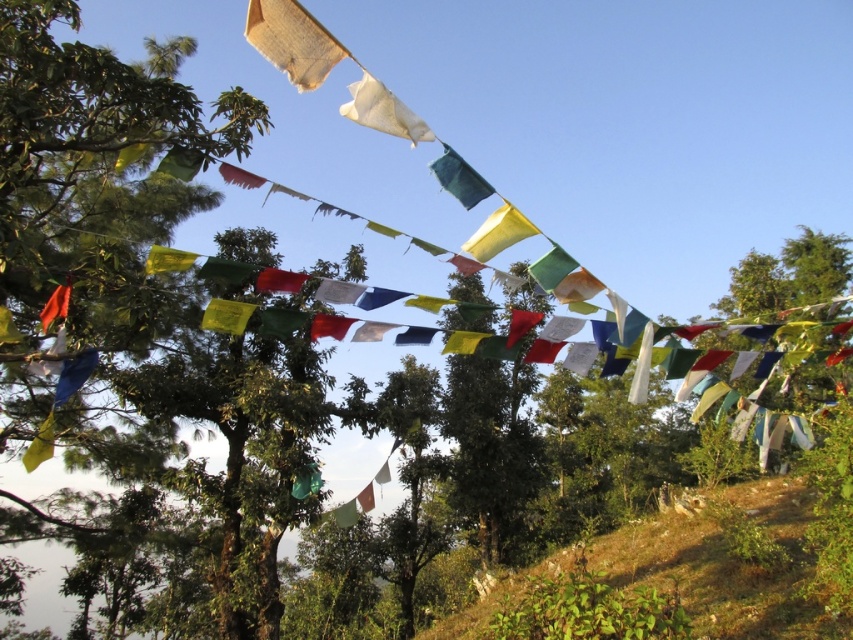
Does white fabric flag at upper center have a lesser height compared to yellow matte flag at center?

Yes, white fabric flag at upper center is shorter than yellow matte flag at center.

Which is above, white fabric flag at upper center or yellow matte flag at center?

white fabric flag at upper center

Which is behind, point (390, 129) or point (526, 225)?

Point (526, 225)

Where is `white fabric flag at upper center`? The image size is (853, 640). white fabric flag at upper center is located at coordinates (383, 112).

Looking at this image, is white fabric flag at upper center closer to camera compared to orange fabric flag at left?

Yes, it is in front of orange fabric flag at left.

Is white fabric flag at upper center to the left of orange fabric flag at left from the viewer's perspective?

Incorrect, white fabric flag at upper center is not on the left side of orange fabric flag at left.

Between point (363, 72) and point (57, 308), which one is positioned behind?

Point (57, 308)

Image resolution: width=853 pixels, height=640 pixels. Identify the location of white fabric flag at upper center. (383, 112).

Which is behind, point (726, 621) or point (306, 40)?

The point (726, 621) is behind.

Can you confirm if green leafy hillside at lower right is shorter than white paper flag at upper center?

No, green leafy hillside at lower right is not shorter than white paper flag at upper center.

The width and height of the screenshot is (853, 640). Find the location of `green leafy hillside at lower right`. green leafy hillside at lower right is located at coordinates (694, 570).